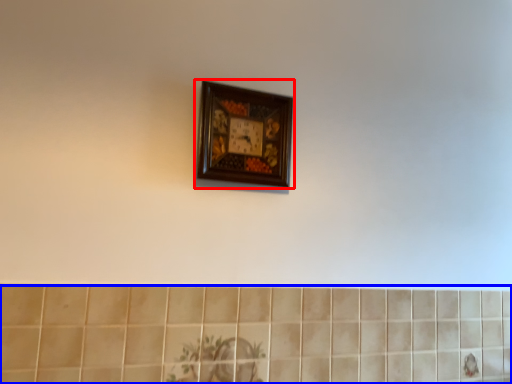
Question: Which point is closer to the camera, picture frame (highlighted by a red box) or ceramic tile (highlighted by a blue box)?

Choices:
 (A) picture frame
 (B) ceramic tile

Answer: (B)